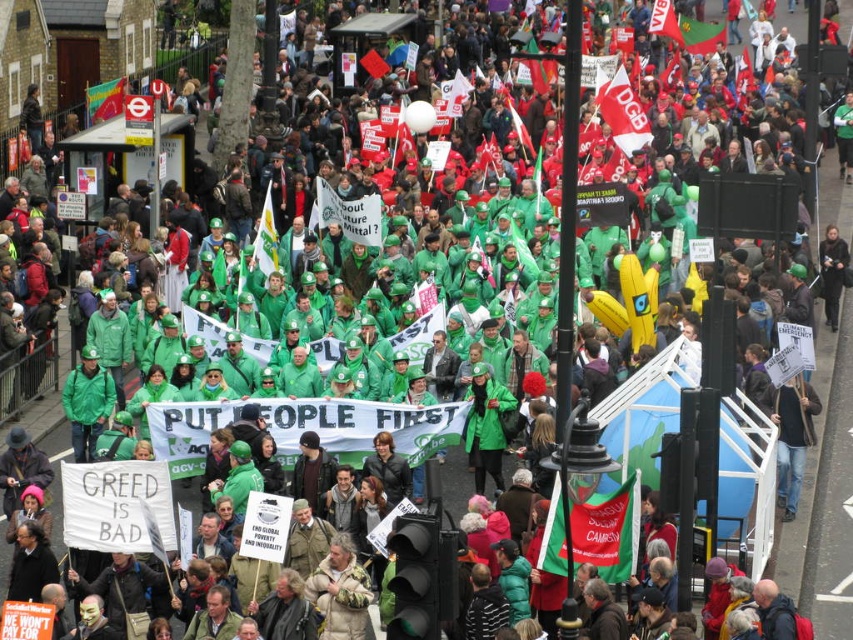
You are a photographer trying to capture the protest scene. You notice two points in the image labeled as point 1 at coordinates (x=552, y=563) and point 2 at coordinates (x=669, y=26). If you want to focus on the point that is closer to you, which one should you choose?

Point 1 at coordinates (x=552, y=563) is closer to the viewer than point 2 at coordinates (x=669, y=26), so you should focus on point 1 at coordinates (x=552, y=563).

You are a photographer standing at the front of the protest crowd. You want to take a photo that includes both the point at coordinates (622, 490) and the point at coordinates (267, 257). Which point should you focus on first to ensure both are in sharp focus?

You should focus on the point at coordinates (622, 490) first because it is closer to the camera. Since it is closer, focusing on it will help ensure the farther point at (267, 257) is also in focus due to depth of field.